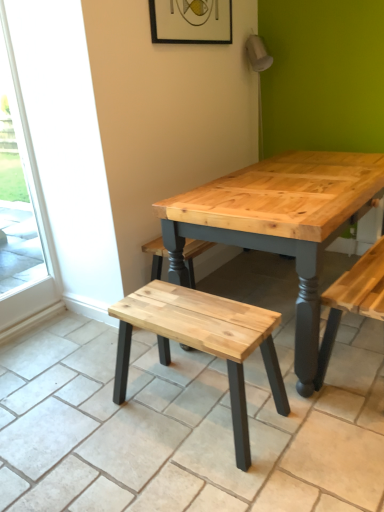
Question: From the image's perspective, is transparent glass screen door at left located beneath wooden frame at upper center?

Choices:
 (A) no
 (B) yes

Answer: (B)

Question: Considering the relative sizes of transparent glass screen door at left and wooden frame at upper center in the image provided, is transparent glass screen door at left wider than wooden frame at upper center?

Choices:
 (A) yes
 (B) no

Answer: (A)

Question: From a real-world perspective, is transparent glass screen door at left on top of wooden frame at upper center?

Choices:
 (A) no
 (B) yes

Answer: (A)

Question: Does transparent glass screen door at left contain wooden frame at upper center?

Choices:
 (A) no
 (B) yes

Answer: (A)

Question: Is transparent glass screen door at left taller than wooden frame at upper center?

Choices:
 (A) yes
 (B) no

Answer: (A)

Question: Is natural wood stool at center taller or shorter than wooden frame at upper center?

Choices:
 (A) short
 (B) tall

Answer: (B)

Question: Is natural wood stool at center in front of or behind wooden frame at upper center in the image?

Choices:
 (A) behind
 (B) front

Answer: (B)

Question: From a real-world perspective, relative to wooden frame at upper center, is natural wood stool at center vertically above or below?

Choices:
 (A) above
 (B) below

Answer: (B)

Question: Looking at their shapes, would you say natural wood stool at center is wider or thinner than wooden frame at upper center?

Choices:
 (A) thin
 (B) wide

Answer: (B)

Question: Visually, is transparent glass screen door at left positioned to the left or to the right of wooden frame at upper center?

Choices:
 (A) right
 (B) left

Answer: (B)

Question: Does point (23, 161) appear closer or farther from the camera than point (193, 40)?

Choices:
 (A) farther
 (B) closer

Answer: (A)

Question: Is transparent glass screen door at left spatially inside wooden frame at upper center, or outside of it?

Choices:
 (A) inside
 (B) outside

Answer: (B)

Question: From the image's perspective, is transparent glass screen door at left above or below wooden frame at upper center?

Choices:
 (A) below
 (B) above

Answer: (A)

Question: Is wooden frame at upper center inside the boundaries of natural wood stool at center, or outside?

Choices:
 (A) inside
 (B) outside

Answer: (B)

Question: Is wooden frame at upper center wider or thinner than natural wood stool at center?

Choices:
 (A) thin
 (B) wide

Answer: (A)